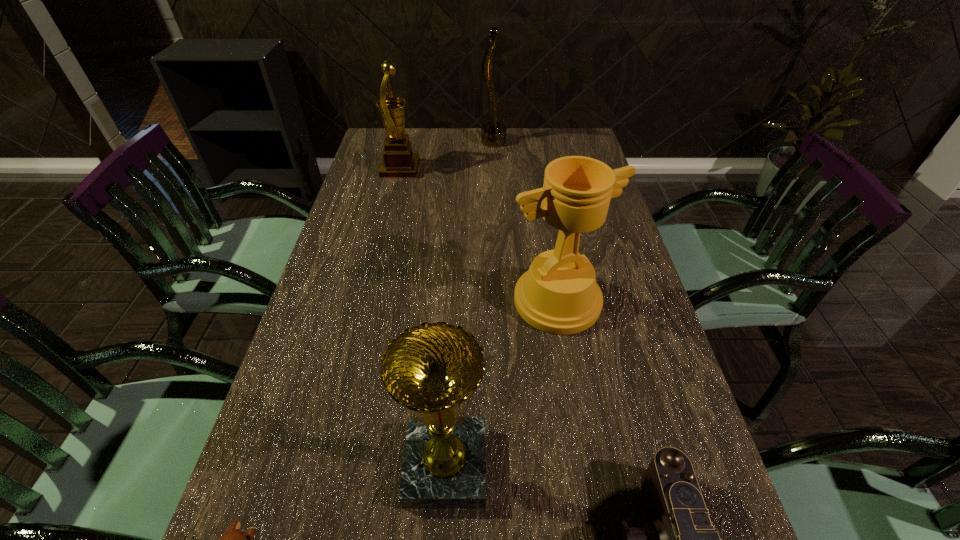
What are the coordinates of `free space between the leftmost award and the nearest award` in the screenshot? It's located at (423, 318).

In order to click on unoccupied area between the fourth nearest object and the third nearest award in this screenshot , I will do `click(479, 235)`.

Image resolution: width=960 pixels, height=540 pixels. I want to click on object that is the second closest to the nearest award, so click(x=680, y=539).

This screenshot has width=960, height=540. I want to click on the closest object to the teddy bear, so click(432, 368).

Select which award appears as the closest to the farthest award. Please provide its 2D coordinates. Your answer should be formatted as a tuple, i.e. [(x, y)], where the tuple contains the x and y coordinates of a point satisfying the conditions above.

[(399, 161)]

Select which award appears as the third closest to the farthest object. Please provide its 2D coordinates. Your answer should be formatted as a tuple, i.e. [(x, y)], where the tuple contains the x and y coordinates of a point satisfying the conditions above.

[(432, 368)]

Where is `free space in the image that satisfies the following two spatial constraints: 1. on the front-facing side of the second farthest object; 2. on the right side of the third farthest award`? This screenshot has height=540, width=960. free space in the image that satisfies the following two spatial constraints: 1. on the front-facing side of the second farthest object; 2. on the right side of the third farthest award is located at coordinates (370, 301).

You are a GUI agent. You are given a task and a screenshot of the screen. Output one action in this format:
    pyautogui.click(x=<x>, y=<y>)
    Task: Click on the free region that satisfies the following two spatial constraints: 1. on the front-facing side of the farthest award; 2. on the front-facing side of the nearest award
    The width and height of the screenshot is (960, 540).
    Given the screenshot: What is the action you would take?
    pyautogui.click(x=508, y=466)

Where is `vacant area in the image that satisfies the following two spatial constraints: 1. on the back side of the third farthest object; 2. on the front-facing side of the farthest object`? Image resolution: width=960 pixels, height=540 pixels. vacant area in the image that satisfies the following two spatial constraints: 1. on the back side of the third farthest object; 2. on the front-facing side of the farthest object is located at coordinates (531, 142).